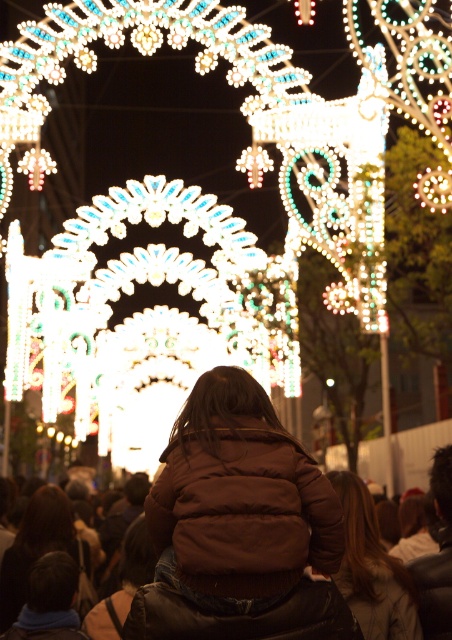
You are a photographer trying to capture both the brown leather jacket at lower center and the brown leather jacket at center in the same frame. Which jacket should you focus on first to ensure both are in view?

The brown leather jacket at lower center is taller than the brown leather jacket at center, so focusing on the taller one first will help ensure both are in the frame.

You are standing at the center of the image and want to place a small gift box at point (264, 605). Is there enough space to place the gift box there? The gift box is 10 cm in width and height. The scene includes a brown leather jacket at lower center.

The brown leather jacket at lower center is located at point (264, 605). Since the gift box is 10 cm in width and height, and the jacket is occupying that position, there is no space to place the gift box there.